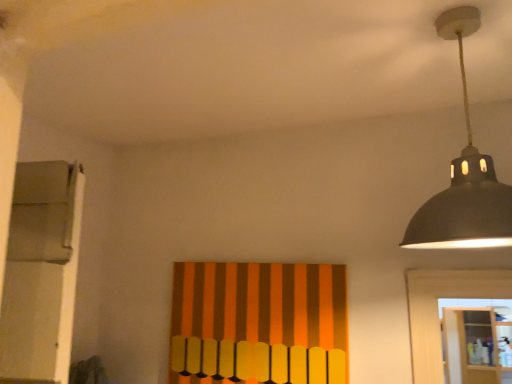
Question: Is wooden cabinet at lower right positioned beyond the bounds of matte black lampshade at upper right?

Choices:
 (A) no
 (B) yes

Answer: (B)

Question: Is wooden cabinet at lower right to the left of matte black lampshade at upper right from the viewer's perspective?

Choices:
 (A) yes
 (B) no

Answer: (B)

Question: Are wooden cabinet at lower right and matte black lampshade at upper right making contact?

Choices:
 (A) yes
 (B) no

Answer: (B)

Question: Does wooden cabinet at lower right lie in front of matte black lampshade at upper right?

Choices:
 (A) yes
 (B) no

Answer: (B)

Question: From a real-world perspective, is wooden cabinet at lower right below matte black lampshade at upper right?

Choices:
 (A) no
 (B) yes

Answer: (B)

Question: Visually, is matte black lampshade at upper right positioned to the left or to the right of wooden cabinet at lower right?

Choices:
 (A) right
 (B) left

Answer: (B)

Question: From their relative heights in the image, would you say matte black lampshade at upper right is taller or shorter than wooden cabinet at lower right?

Choices:
 (A) short
 (B) tall

Answer: (A)

Question: Relative to wooden cabinet at lower right, is matte black lampshade at upper right in front or behind?

Choices:
 (A) front
 (B) behind

Answer: (A)

Question: Is matte black lampshade at upper right situated inside wooden cabinet at lower right or outside?

Choices:
 (A) outside
 (B) inside

Answer: (A)

Question: Considering the positions of wooden cabinet at lower right and matte black lampshade at upper right in the image, is wooden cabinet at lower right wider or thinner than matte black lampshade at upper right?

Choices:
 (A) wide
 (B) thin

Answer: (B)

Question: In terms of size, does wooden cabinet at lower right appear bigger or smaller than matte black lampshade at upper right?

Choices:
 (A) small
 (B) big

Answer: (B)

Question: Is wooden cabinet at lower right to the left or to the right of matte black lampshade at upper right in the image?

Choices:
 (A) left
 (B) right

Answer: (B)

Question: Considering the positions of wooden cabinet at lower right and matte black lampshade at upper right in the image, is wooden cabinet at lower right taller or shorter than matte black lampshade at upper right?

Choices:
 (A) short
 (B) tall

Answer: (B)

Question: Is orange striped fabric at center wider or thinner than wooden cabinet at lower right?

Choices:
 (A) thin
 (B) wide

Answer: (A)

Question: Is orange striped fabric at center inside the boundaries of wooden cabinet at lower right, or outside?

Choices:
 (A) outside
 (B) inside

Answer: (A)